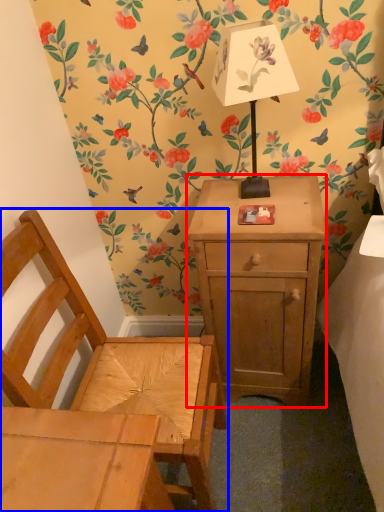
Question: Among these objects, which one is farthest to the camera, nightstand (highlighted by a red box) or chair (highlighted by a blue box)?

Choices:
 (A) nightstand
 (B) chair

Answer: (A)